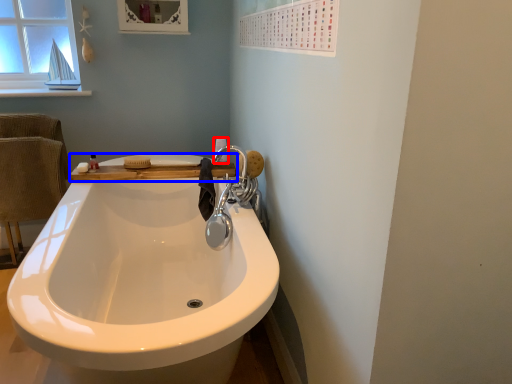
Question: Which object is further to the camera taking this photo, toilet paper (highlighted by a red box) or counter top (highlighted by a blue box)?

Choices:
 (A) toilet paper
 (B) counter top

Answer: (A)